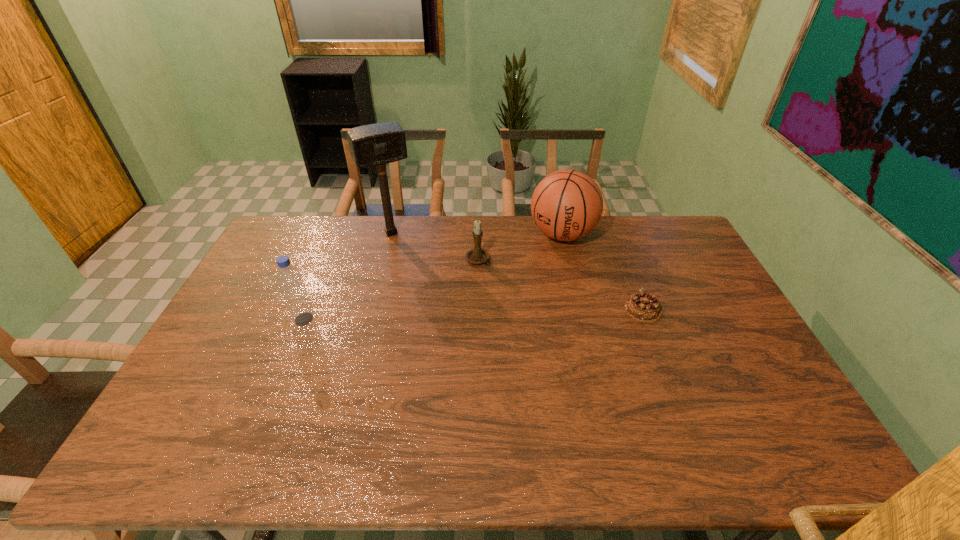
The width and height of the screenshot is (960, 540). I want to click on free spot that satisfies the following two spatial constraints: 1. on the front side of the fourth object from right to left; 2. on the left side of the chocolate cake, so click(x=372, y=309).

Find the location of a particular element. The width and height of the screenshot is (960, 540). free location that satisfies the following two spatial constraints: 1. on the front side of the mallet; 2. on the left side of the second shortest object is located at coordinates (384, 260).